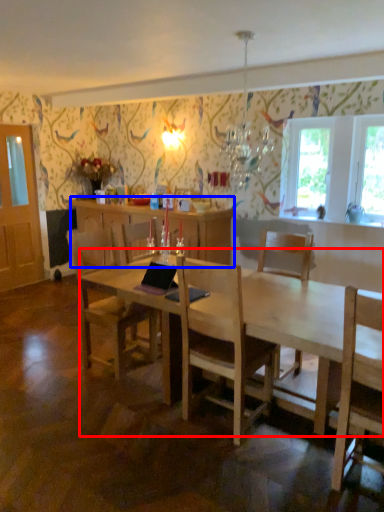
Question: Which object is further to the camera taking this photo, desk (highlighted by a red box) or cabinetry (highlighted by a blue box)?

Choices:
 (A) desk
 (B) cabinetry

Answer: (B)